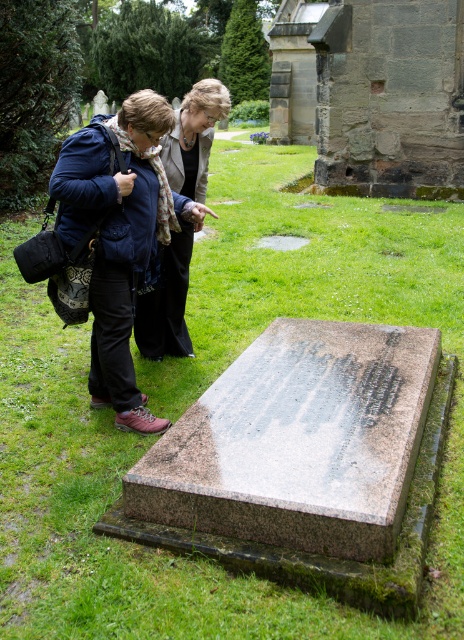
You are a photographer trying to capture both the matte blue jacket at upper left and the matte black jacket at center in a single frame. Given their sizes, which jacket should you position closer to the camera to ensure both appear similarly sized in the photo?

Since the matte blue jacket at upper left is bigger than the matte black jacket at center, you should position the matte black jacket at center closer to the camera to balance their sizes in the photo.

You are standing at the entrance of the cemetery and want to visit the granite gravestone at center. According to the map coordinates provided, what are the coordinates where you should head towards?

The granite gravestone at center is located at point [298,440], so you should head towards those coordinates to reach it.

You are standing in a cemetery and see the granite gravestone at center and the matte black jacket at center. Which object is positioned to the right of the other?

The granite gravestone at center is to the right of the matte black jacket at center.